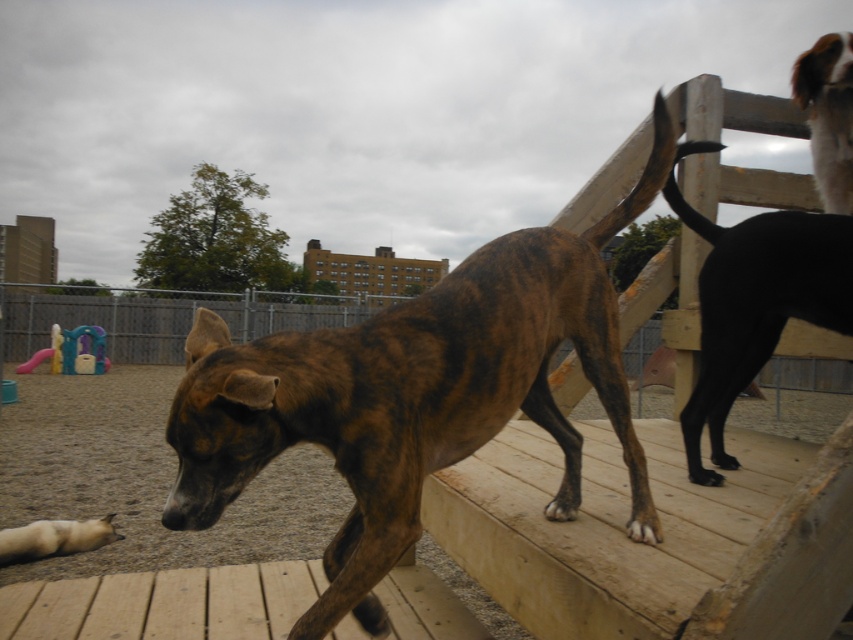
Can you confirm if brown brindle dog at center is thinner than brown brindle dog at upper right?

Incorrect, brown brindle dog at center's width is not less than brown brindle dog at upper right's.

Which is more to the right, brown brindle dog at center or brown brindle dog at upper right?

From the viewer's perspective, brown brindle dog at upper right appears more on the right side.

Is point (376, 461) farther from camera compared to point (846, 140)?

No.

Locate an element on the screen. This screenshot has width=853, height=640. brown brindle dog at center is located at coordinates (415, 392).

Is brown wooden rail at center to the left of brown brindle dog at upper right from the viewer's perspective?

Indeed, brown wooden rail at center is positioned on the left side of brown brindle dog at upper right.

Who is more forward, (35,289) or (819,54)?

Point (819,54) is in front.

At what (x,y) coordinates should I click in order to perform the action: click on brown wooden rail at center. Please return your answer as a coordinate pair (x, y). The width and height of the screenshot is (853, 640). Looking at the image, I should click on (163, 317).

Between brown brindle dog at center and white fur dog at lower left, which one is positioned lower?

white fur dog at lower left is lower down.

Consider the image. Between brown brindle dog at center and white fur dog at lower left, which one has less height?

white fur dog at lower left is shorter.

Is point (224, 476) positioned behind point (59, 552)?

No.

Find the location of a particular element. Image resolution: width=853 pixels, height=640 pixels. brown brindle dog at center is located at coordinates (415, 392).